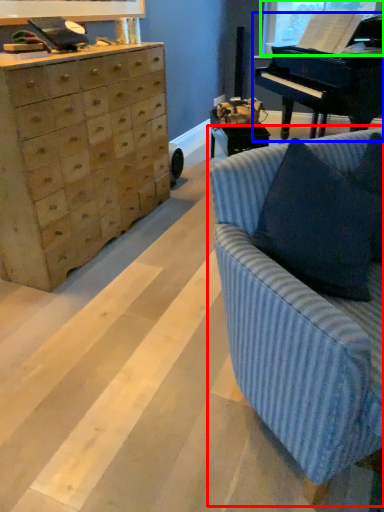
Question: Estimate the real-world distances between objects in this image. Which object is farther from studio couch (highlighted by a red box), piano (highlighted by a blue box) or window screen (highlighted by a green box)?

Choices:
 (A) piano
 (B) window screen

Answer: (B)